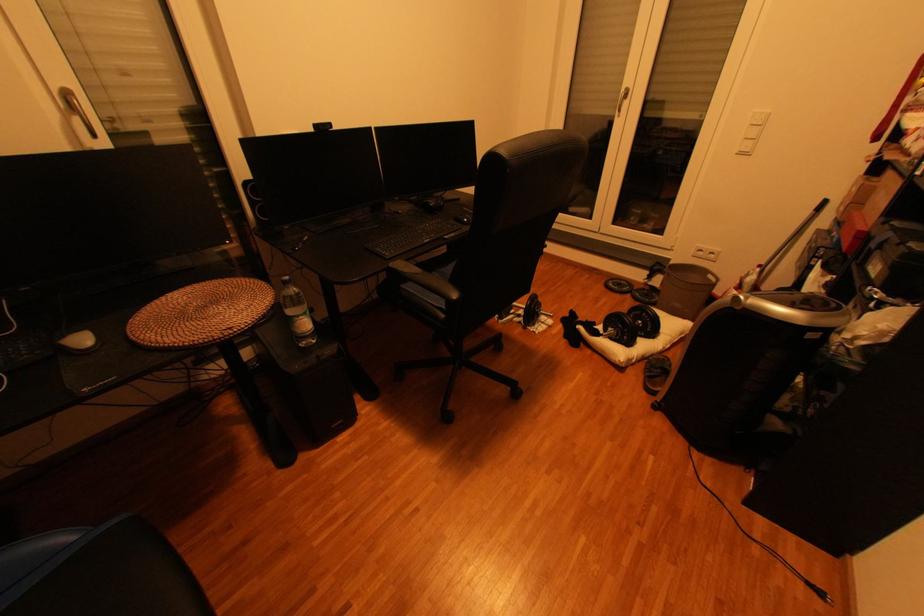
Where is `window handle`? Image resolution: width=924 pixels, height=616 pixels. window handle is located at coordinates (623, 100).